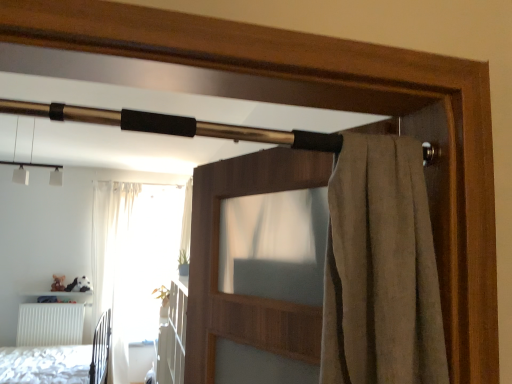
Question: Can you confirm if white textured bed at lower left is shorter than brown fabric screen door at upper center?

Choices:
 (A) no
 (B) yes

Answer: (A)

Question: Can you confirm if white textured bed at lower left is taller than brown fabric screen door at upper center?

Choices:
 (A) yes
 (B) no

Answer: (A)

Question: From the image's perspective, would you say white textured bed at lower left is positioned over brown fabric screen door at upper center?

Choices:
 (A) no
 (B) yes

Answer: (A)

Question: From a real-world perspective, is white textured bed at lower left below brown fabric screen door at upper center?

Choices:
 (A) no
 (B) yes

Answer: (B)

Question: Is white textured bed at lower left behind brown fabric screen door at upper center?

Choices:
 (A) no
 (B) yes

Answer: (B)

Question: Is white sheer curtain at left in front of or behind brown fabric screen door at upper center in the image?

Choices:
 (A) behind
 (B) front

Answer: (A)

Question: From a real-world perspective, is white sheer curtain at left positioned above or below brown fabric screen door at upper center?

Choices:
 (A) above
 (B) below

Answer: (B)

Question: Considering the positions of white sheer curtain at left and brown fabric screen door at upper center in the image, is white sheer curtain at left wider or thinner than brown fabric screen door at upper center?

Choices:
 (A) wide
 (B) thin

Answer: (A)

Question: Is white sheer curtain at left taller or shorter than brown fabric screen door at upper center?

Choices:
 (A) short
 (B) tall

Answer: (B)

Question: Does point (200, 183) appear closer or farther from the camera than point (36, 337)?

Choices:
 (A) farther
 (B) closer

Answer: (B)

Question: Is brown fabric screen door at upper center inside the boundaries of white textured bed at lower left, or outside?

Choices:
 (A) outside
 (B) inside

Answer: (A)

Question: Visually, is brown fabric screen door at upper center positioned to the left or to the right of white textured bed at lower left?

Choices:
 (A) left
 (B) right

Answer: (B)

Question: From a real-world perspective, relative to white textured bed at lower left, is brown fabric screen door at upper center vertically above or below?

Choices:
 (A) below
 (B) above

Answer: (B)

Question: Looking at their shapes, would you say white textured bed at lower left is wider or thinner than white sheer curtain at left?

Choices:
 (A) thin
 (B) wide

Answer: (B)

Question: In the image, is white textured bed at lower left positioned in front of or behind white sheer curtain at left?

Choices:
 (A) behind
 (B) front

Answer: (B)